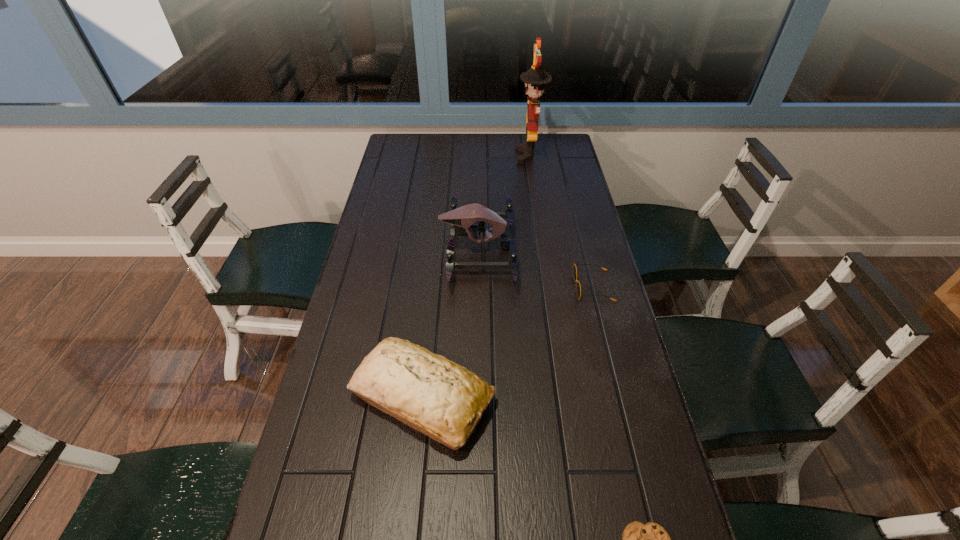
The width and height of the screenshot is (960, 540). Find the location of `vacant region located 0.060m on the left of the fourth farthest object`. vacant region located 0.060m on the left of the fourth farthest object is located at coordinates (324, 398).

The width and height of the screenshot is (960, 540). What are the coordinates of `vacant space located 0.110m on the front-facing side of the sunglasses` in the screenshot? It's located at (536, 286).

Where is `vacant space located on the front-facing side of the sunglasses`? This screenshot has height=540, width=960. vacant space located on the front-facing side of the sunglasses is located at coordinates pyautogui.click(x=480, y=286).

The height and width of the screenshot is (540, 960). What are the coordinates of `vacant area situated on the front-facing side of the sunglasses` in the screenshot? It's located at (456, 286).

Identify the location of object that is at the far edge. (535, 78).

The height and width of the screenshot is (540, 960). In order to click on object located in the left edge section of the desktop in this screenshot , I will do `click(445, 401)`.

This screenshot has height=540, width=960. Identify the location of nutcracker positioned at the right edge. (535, 78).

Identify the location of sunglasses at the right edge. This screenshot has height=540, width=960. (578, 287).

The width and height of the screenshot is (960, 540). I want to click on object at the far right corner, so 535,78.

Locate an element on the screen. Image resolution: width=960 pixels, height=540 pixels. vacant space at the far edge of the desktop is located at coordinates (497, 140).